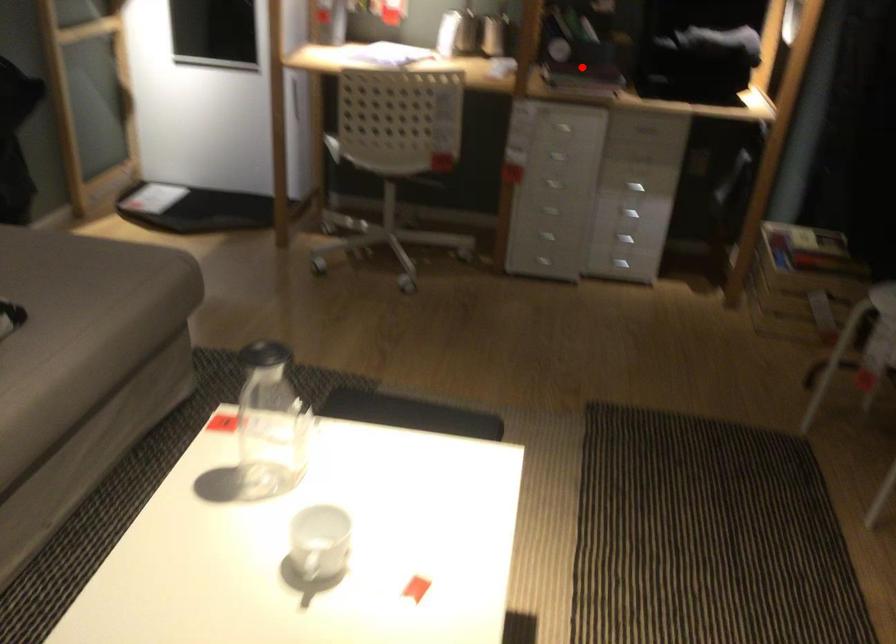
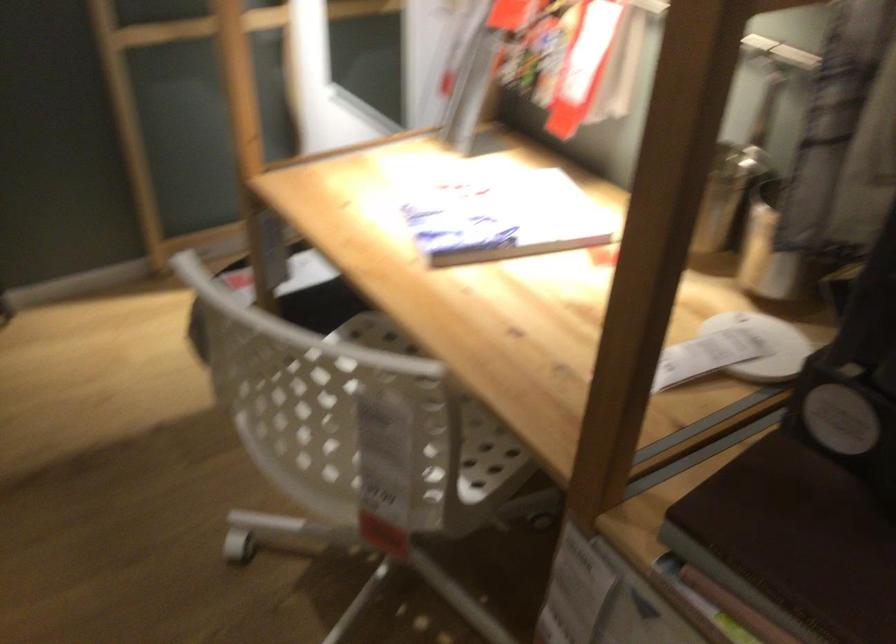
Question: I am providing you with two images of the same scene from different viewpoints. Given a red point in image1, look at the same physical point in image2. Is it:

Choices:
 (A) Closer to the viewpoint
 (B) Farther from the viewpoint

Answer: (A)